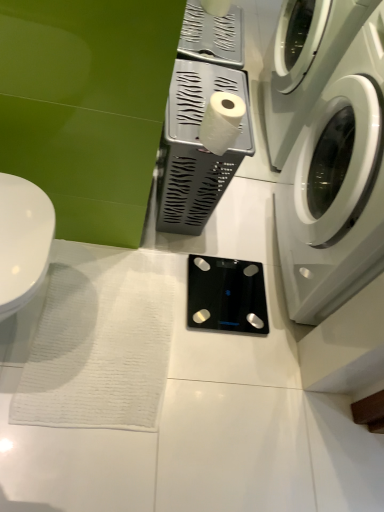
This screenshot has width=384, height=512. What are the coordinates of `free space that is in between white glossy washing machine at right and black glass scale at center, acting as the 2th appliance starting from the top` in the screenshot? It's located at (243, 234).